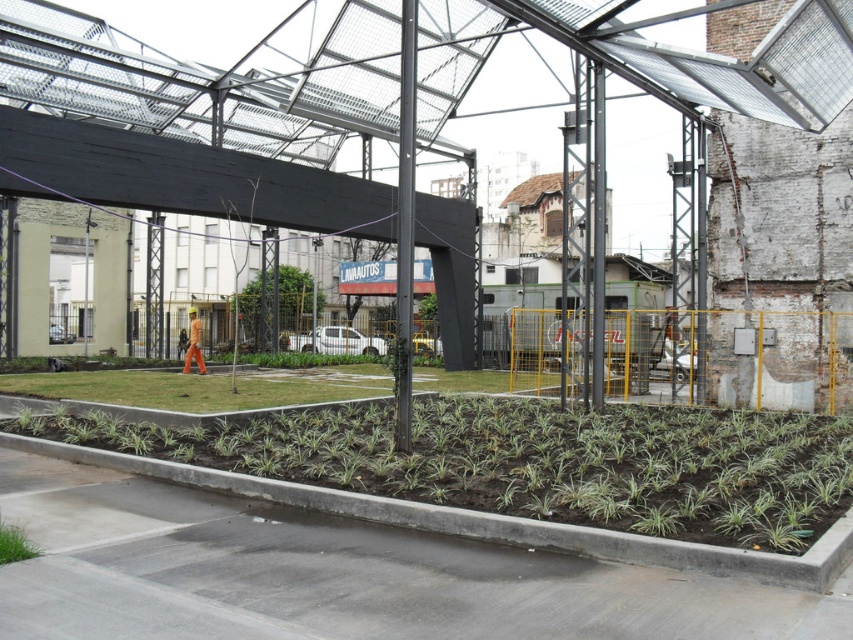
You are a gardener who needs to plant a new shrub that requires a space of at least 1 meter in width. Looking at the scene, can you determine if the green leafy plants at lower center or the green grass at lower left have enough width to accommodate the shrub?

The green leafy plants at lower center might be wider than green grass at lower left. However, without exact measurements, it is uncertain if either reaches the required 1 meter width for the shrub. Consult the actual dimensions before planting.

You are a gardener who needs to water both the green leafy plants at lower center and the green grass at lower left. Your watering can holds enough water to cover 5 meters. Can you water both areas without refilling?

The green leafy plants at lower center and green grass at lower left are 5.09 meters apart from each other. Since the watering can can only cover 5 meters, you cannot water both areas without refilling.

You are a gardener who needs to water both the green leafy plants at lower center and the green grass at lower left. Based on the scene description, which of these two areas is positioned higher in elevation?

The green leafy plants at lower center are positioned above the green grass at lower left, so they are higher in elevation.